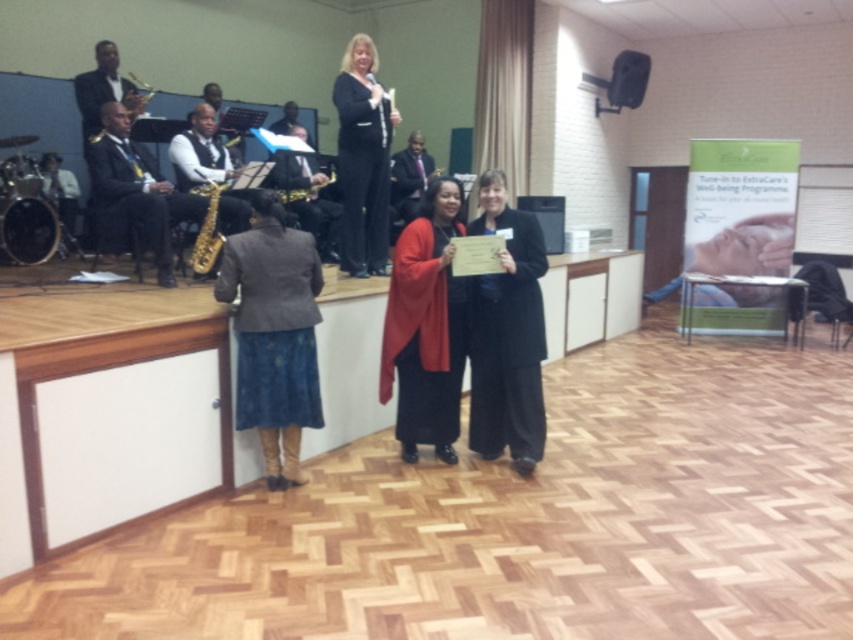
You are a photographer at the event and need to capture both the matte red coat at center and the shiny black suit at left in a single frame. Considering their heights, which one should you focus on to ensure both are visible without cropping?

Since the matte red coat at center is taller than the shiny black suit at left, you should focus on the matte red coat at center to ensure both are visible without cropping.

You are attending an indoor event and want to take a photo of both the matte red coat at center and the black glossy suit at upper center. Which one should you focus on first if you want to capture them both in the frame?

The matte red coat at center is to the right of the black glossy suit at upper center, so you should focus on the black glossy suit at upper center first to ensure both are in the frame.

You are standing at the center of the community hall and see the point marked at coordinates [426,326]. What object is located at that point?

The point at coordinates [426,326] indicates the location of the matte red coat at center.